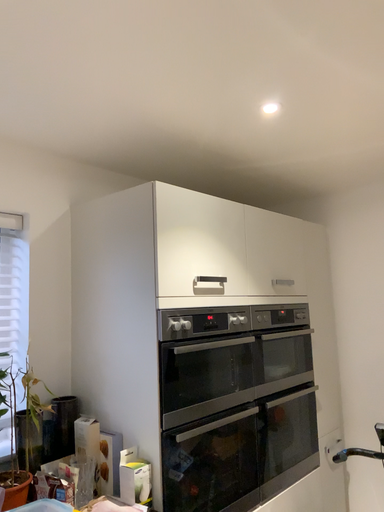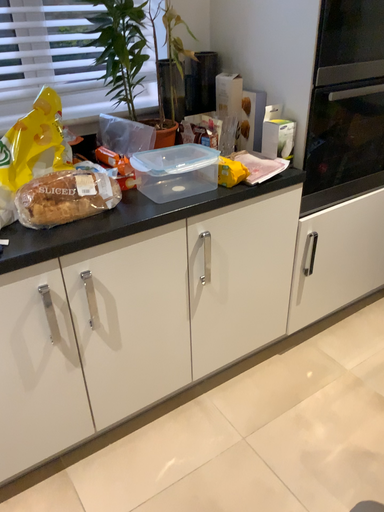
Question: Which way did the camera rotate in the video?

Choices:
 (A) rotated upward
 (B) rotated downward

Answer: (B)